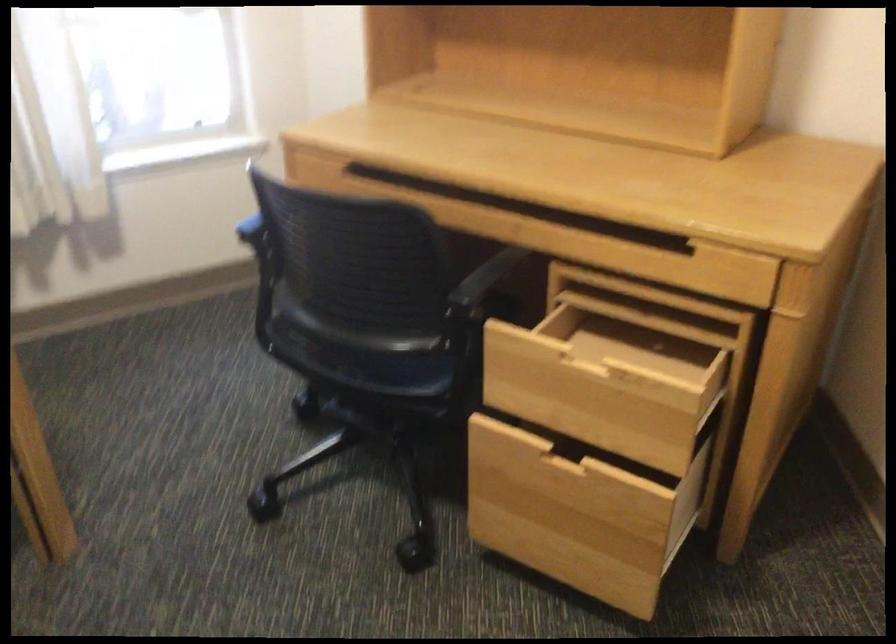
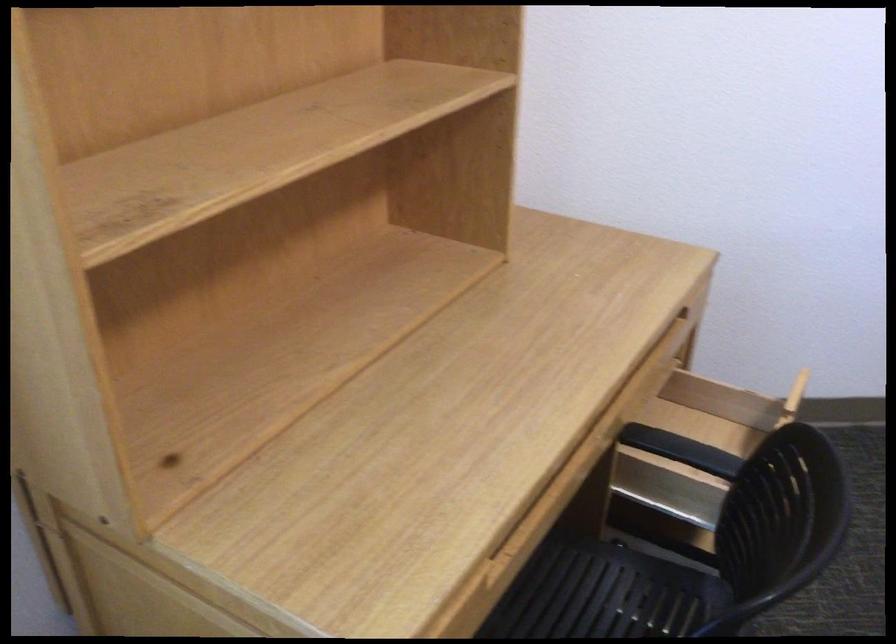
Where in the second image is the point corresponding to pixel 764 283 from the first image?

(691, 313)